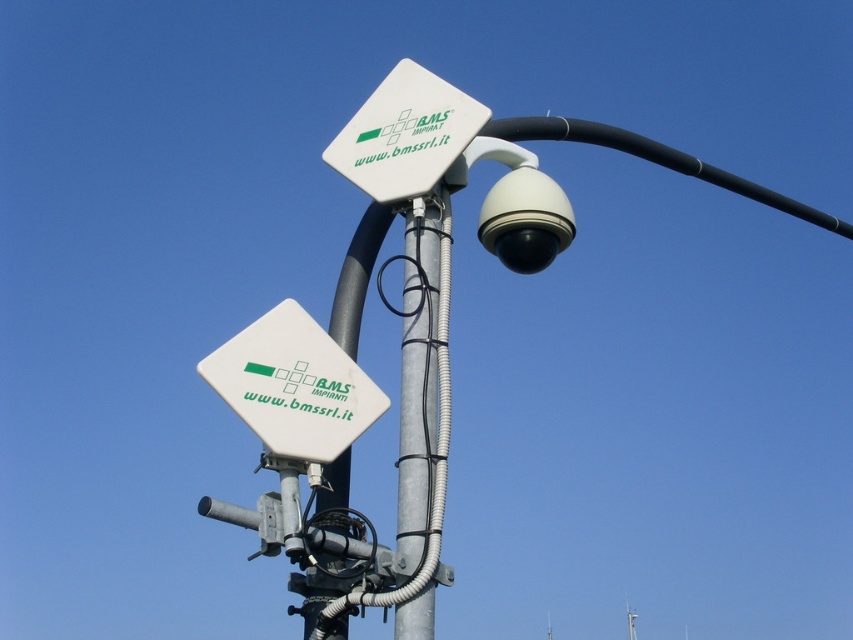
Can you confirm if white matte sign at upper left is positioned to the right of silver metallic pole at center?

In fact, white matte sign at upper left is to the left of silver metallic pole at center.

Is white matte sign at upper left shorter than silver metallic pole at center?

Indeed, white matte sign at upper left has a lesser height compared to silver metallic pole at center.

Which is in front, point (258, 394) or point (412, 435)?

Positioned in front is point (258, 394).

Locate an element on the screen. This screenshot has width=853, height=640. white matte sign at upper left is located at coordinates (293, 385).

What do you see at coordinates (293, 385) in the screenshot? This screenshot has height=640, width=853. I see `white matte sign at upper left` at bounding box center [293, 385].

Who is taller, white matte sign at upper left or white plastic pole at center?

white plastic pole at center is taller.

Who is more distant from viewer, (328, 435) or (335, 320)?

Point (335, 320)

I want to click on white matte sign at upper left, so click(293, 385).

Is silver metallic pole at center below white plastic pole at center?

No, silver metallic pole at center is not below white plastic pole at center.

Can you confirm if silver metallic pole at center is shorter than white plastic pole at center?

No, silver metallic pole at center is not shorter than white plastic pole at center.

Where is `silver metallic pole at center`? The height and width of the screenshot is (640, 853). silver metallic pole at center is located at coordinates (419, 376).